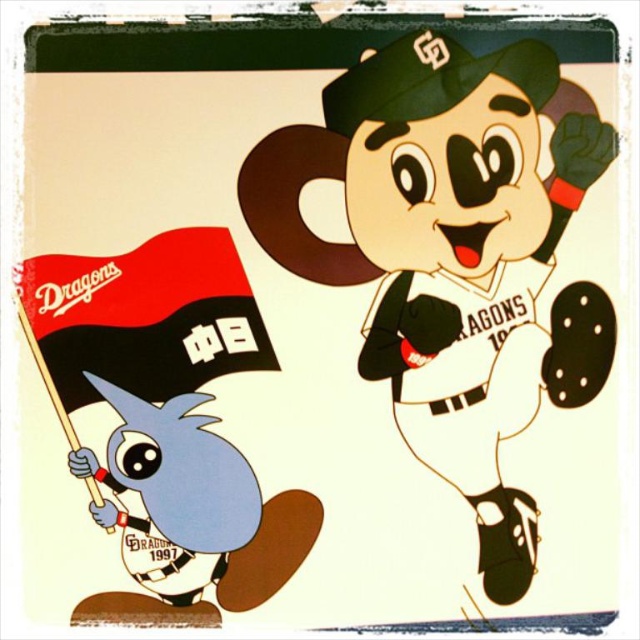
Does matte black mascot at right have a greater width compared to black fabric flag at lower left?

Yes, matte black mascot at right is wider than black fabric flag at lower left.

Which of these two, matte black mascot at right or black fabric flag at lower left, stands taller?

Standing taller between the two is matte black mascot at right.

Between point (531, 243) and point (262, 328), which one is positioned behind?

Point (262, 328)

The image size is (640, 640). Find the location of `matte black mascot at right`. matte black mascot at right is located at coordinates (452, 253).

Does point (145, 272) lie in front of point (120, 429)?

No, (145, 272) is behind (120, 429).

Is point (67, 272) in front of point (163, 432)?

Yes, it is in front of point (163, 432).

Image resolution: width=640 pixels, height=640 pixels. I want to click on black fabric flag at lower left, so click(145, 316).

Which is more to the left, matte black mascot at right or blue matte bird at lower left?

blue matte bird at lower left

Between point (356, 218) and point (156, 593), which one is positioned in front?

Point (156, 593) is in front.

At what (x,y) coordinates should I click in order to perform the action: click on matte black mascot at right. Please return your answer as a coordinate pair (x, y). This screenshot has height=640, width=640. Looking at the image, I should click on (452, 253).